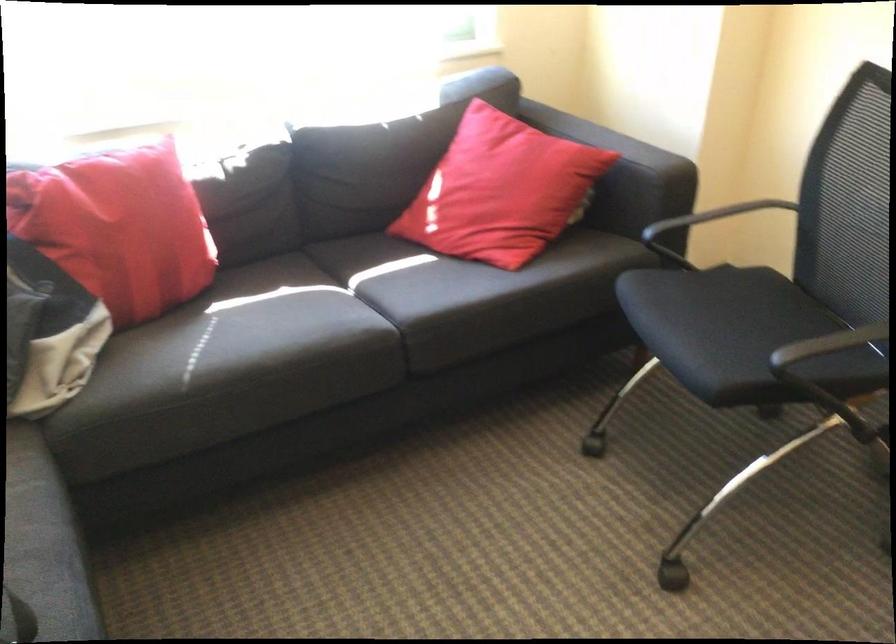
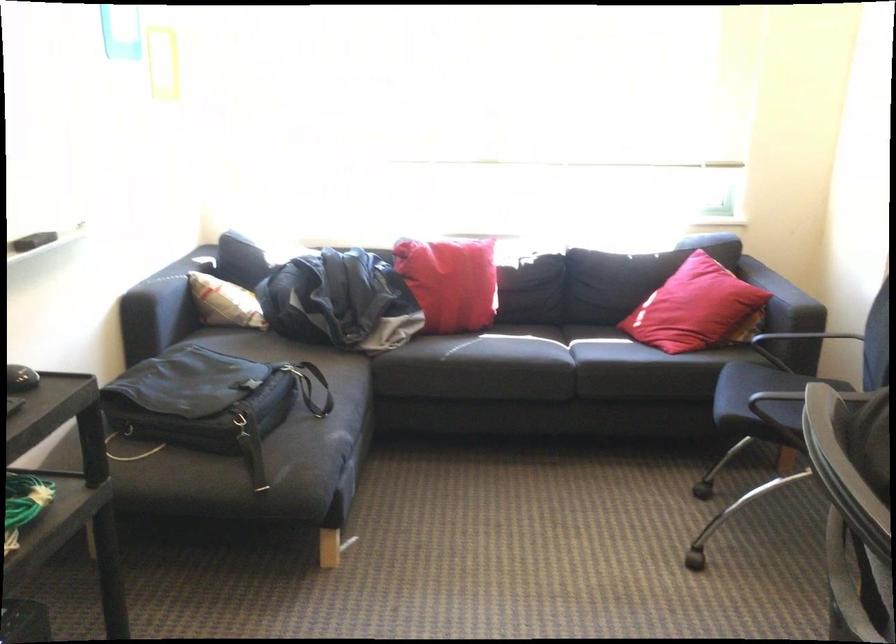
In the second image, find the point that corresponds to point (513, 199) in the first image.

(695, 308)